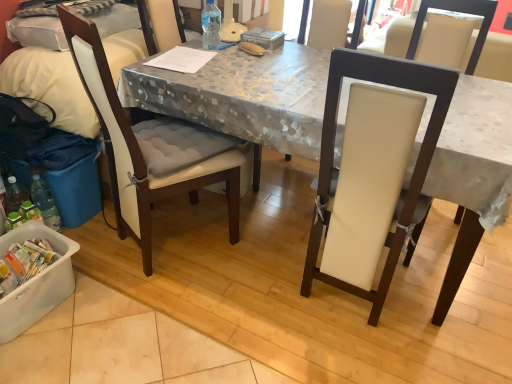
The width and height of the screenshot is (512, 384). Identify the location of free region on the left part of white leather chair at center, which appears as the second chair when viewed from the left. (248, 284).